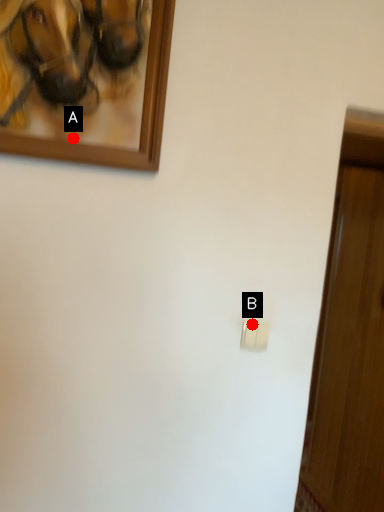
Question: Two points are circled on the image, labeled by A and B beside each circle. Which point is further to the camera?

Choices:
 (A) A is further
 (B) B is further

Answer: (B)